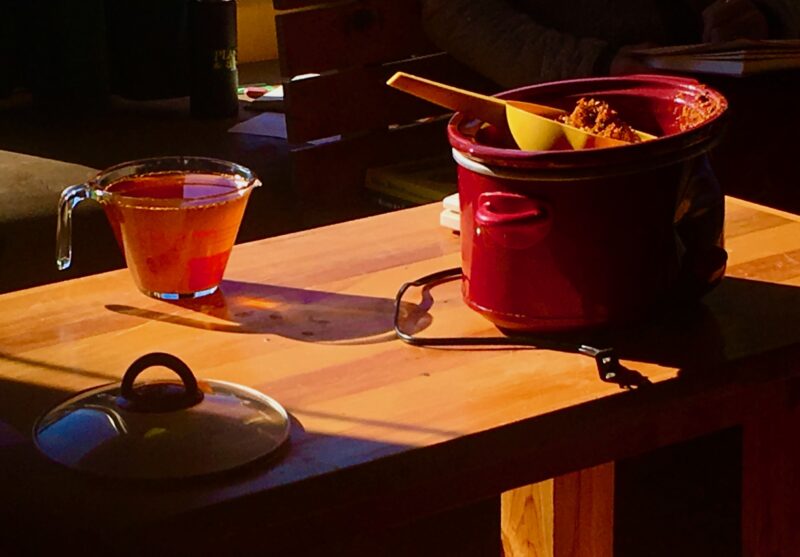
Where is `pot lid`? The height and width of the screenshot is (557, 800). pot lid is located at coordinates (190, 417).